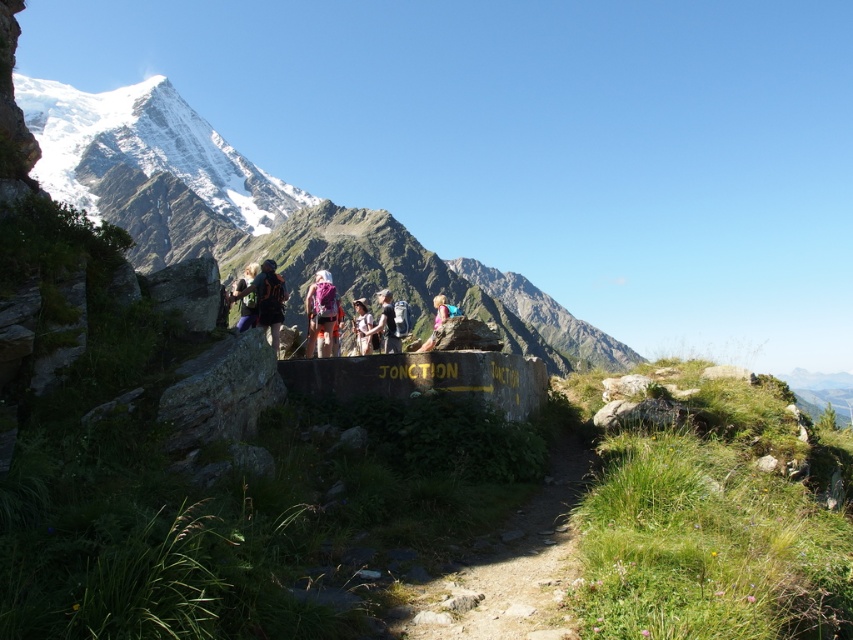
Is dirt path at center to the left of black fabric backpack at center from the viewer's perspective?

In fact, dirt path at center is to the right of black fabric backpack at center.

Does dirt path at center come in front of black fabric backpack at center?

Yes.

Describe the element at coordinates (508, 566) in the screenshot. Image resolution: width=853 pixels, height=640 pixels. I see `dirt path at center` at that location.

Find the location of a particular element. dirt path at center is located at coordinates (508, 566).

Is point (309, 308) less distant than point (245, 284)?

No, (309, 308) is behind (245, 284).

I want to click on pink fabric backpack at center, so click(x=321, y=314).

Which of these two, matte black backpack at center or black fabric backpack at center, stands shorter?

With less height is black fabric backpack at center.

Between matte black backpack at center and black fabric backpack at center, which one is positioned higher?

matte black backpack at center

Between point (244, 269) and point (393, 349), which one is positioned in front?

Positioned in front is point (393, 349).

Find the location of a particular element. This screenshot has height=640, width=853. matte black backpack at center is located at coordinates (247, 298).